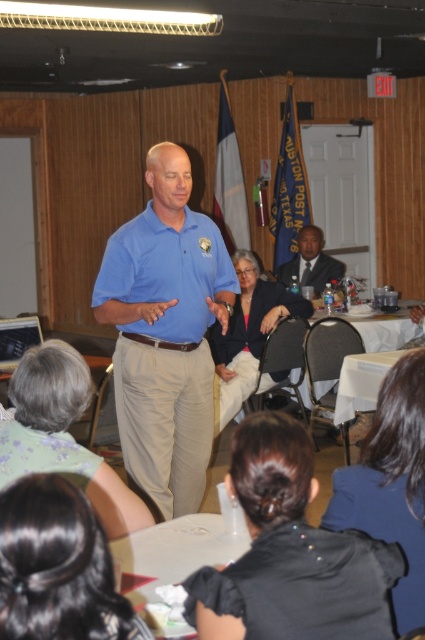
Question: Which object is positioned closest to the matte blue shirt at center?

Choices:
 (A) dark gray suit at center
 (B) white plastic table at lower center

Answer: (B)

Question: Is matte blue shirt at center below dark gray suit at center?

Choices:
 (A) yes
 (B) no

Answer: (A)

Question: Can you confirm if matte blue shirt at center is wider than dark gray suit at center?

Choices:
 (A) no
 (B) yes

Answer: (B)

Question: Is matte blue shirt at center below white plastic table at lower center?

Choices:
 (A) no
 (B) yes

Answer: (A)

Question: Based on their relative distances, which object is nearer to the dark gray suit at center?

Choices:
 (A) matte blue shirt at center
 (B) white plastic table at lower center

Answer: (A)

Question: Which of the following is the closest to the observer?

Choices:
 (A) (147, 349)
 (B) (342, 268)
 (C) (200, 561)

Answer: (C)